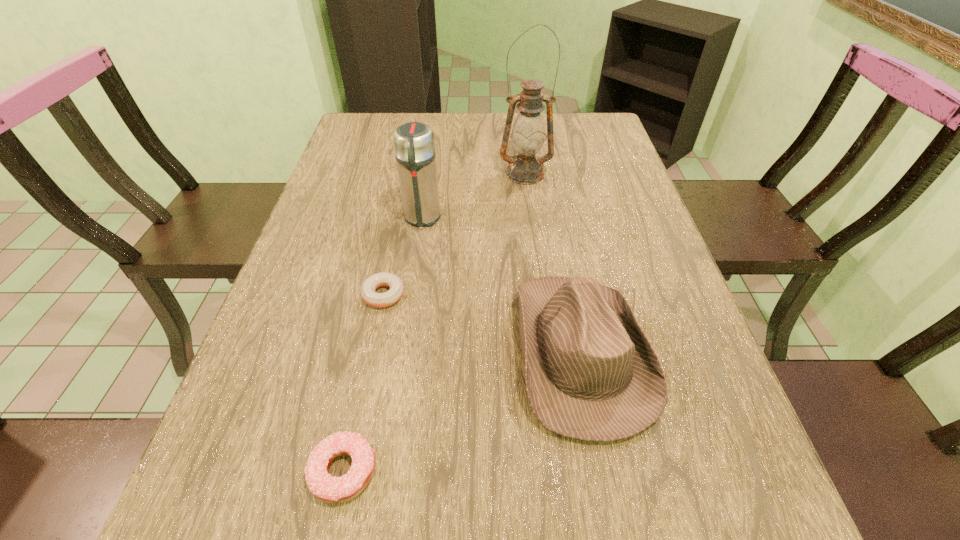
The height and width of the screenshot is (540, 960). I want to click on vacant space situated with a handle on the side of the second tallest object, so click(408, 317).

Locate an element on the screen. free spot located 0.180m on the left of the third tallest object is located at coordinates (423, 351).

Find the location of `free space located on the right of the nearer doughnut`. free space located on the right of the nearer doughnut is located at coordinates (636, 471).

Find the location of a particular element. The width and height of the screenshot is (960, 540). blank space located on the front of the shorter doughnut is located at coordinates (339, 513).

Locate an element on the screen. The height and width of the screenshot is (540, 960). object at the left edge is located at coordinates (326, 488).

I want to click on object situated at the right edge, so click(x=592, y=374).

The height and width of the screenshot is (540, 960). I want to click on vacant space at the left edge, so click(x=321, y=258).

In the image, there is a desktop. What are the coordinates of `blank space at the right edge` in the screenshot? It's located at [x=677, y=306].

Identify the location of vacant space at the far left corner of the desktop. The image size is (960, 540). [358, 130].

What are the coordinates of `empty location between the second farthest object and the oil lamp` in the screenshot? It's located at (473, 196).